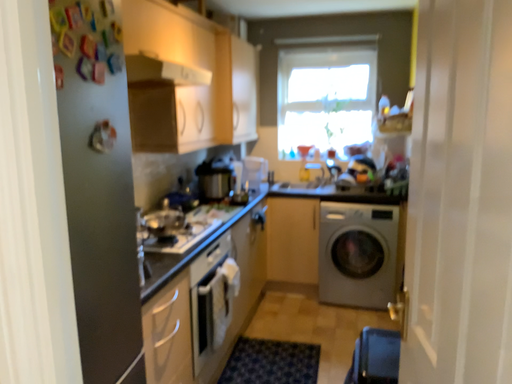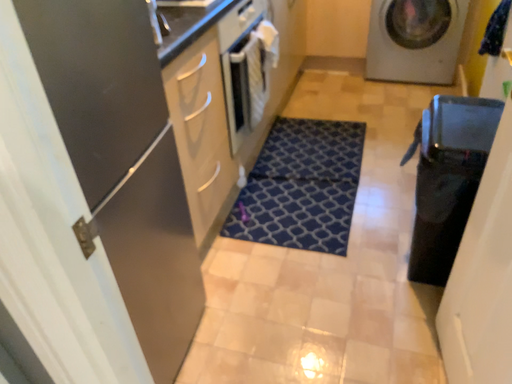
Question: Which way did the camera rotate in the video?

Choices:
 (A) rotated downward
 (B) rotated upward

Answer: (A)